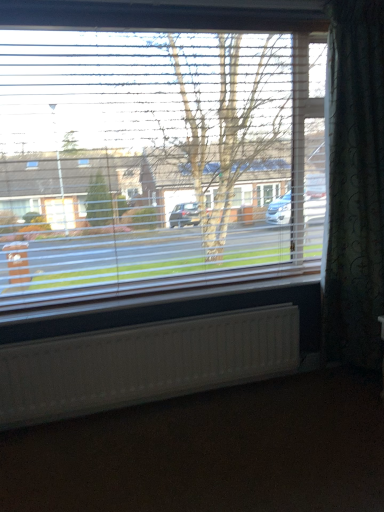
This screenshot has height=512, width=384. What are the coordinates of `brown matte carpet at lower center` in the screenshot? It's located at (210, 452).

Is dark green textured curtain at right oriented away from white textured radiator at lower center?

dark green textured curtain at right is not turned away from white textured radiator at lower center.

Which object is further away from the camera, dark green textured curtain at right or white textured radiator at lower center?

white textured radiator at lower center is more distant.

Would you say dark green textured curtain at right is a long distance from white textured radiator at lower center?

They are positioned close to each other.

Is white textured radiator at lower center directly adjacent to transparent plastic blinds at upper center?

white textured radiator at lower center and transparent plastic blinds at upper center are clearly separated.

Is white textured radiator at lower center oriented away from transparent plastic blinds at upper center?

No.

Where is `radiator behind the transparent plastic blinds at upper center`? radiator behind the transparent plastic blinds at upper center is located at coordinates (144, 362).

Considering the relative sizes of white textured radiator at lower center and transparent plastic blinds at upper center in the image provided, is white textured radiator at lower center wider than transparent plastic blinds at upper center?

No.

From a real-world perspective, is transparent plastic blinds at upper center below white textured radiator at lower center?

No.

From the image's perspective, is transparent plastic blinds at upper center on white textured radiator at lower center?

Yes, from the image's perspective, transparent plastic blinds at upper center is on top of white textured radiator at lower center.

Is transparent plastic blinds at upper center positioned far away from white textured radiator at lower center?

No, transparent plastic blinds at upper center is not far away from white textured radiator at lower center.

What's the angular difference between transparent plastic blinds at upper center and white textured radiator at lower center's facing directions?

0.0192 degrees.

In the scene shown: From a real-world perspective, which object rests below the other?

brown matte carpet at lower center, from a real-world perspective.

Would you say white textured radiator at lower center contains brown matte carpet at lower center?

No, brown matte carpet at lower center is not surrounded by white textured radiator at lower center.

Which object is further away from the camera, white textured radiator at lower center or brown matte carpet at lower center?

white textured radiator at lower center is further from the camera.

From the image's perspective, which is below, white textured radiator at lower center or brown matte carpet at lower center?

From the image's view, brown matte carpet at lower center is below.

Visually, is transparent plastic blinds at upper center positioned to the left or to the right of dark green textured curtain at right?

Based on their positions, transparent plastic blinds at upper center is located to the left of dark green textured curtain at right.

Is point (107, 258) closer to camera compared to point (327, 276)?

Yes, point (107, 258) is in front of point (327, 276).

Considering the sizes of transparent plastic blinds at upper center and dark green textured curtain at right in the image, is transparent plastic blinds at upper center taller or shorter than dark green textured curtain at right?

Considering their sizes, transparent plastic blinds at upper center has less height than dark green textured curtain at right.

Is brown matte carpet at lower center inside transparent plastic blinds at upper center?

No, brown matte carpet at lower center is located outside of transparent plastic blinds at upper center.

From the image's perspective, is transparent plastic blinds at upper center over brown matte carpet at lower center?

Yes.

Is transparent plastic blinds at upper center next to brown matte carpet at lower center and touching it?

No, transparent plastic blinds at upper center is not making contact with brown matte carpet at lower center.

From a real-world perspective, is transparent plastic blinds at upper center on top of brown matte carpet at lower center?

Yes, from a real-world perspective, transparent plastic blinds at upper center is on top of brown matte carpet at lower center.

Is brown matte carpet at lower center touching dark green textured curtain at right?

No, brown matte carpet at lower center is not in contact with dark green textured curtain at right.

From a real-world perspective, which object stands above the other?

dark green textured curtain at right, from a real-world perspective.

From the image's perspective, is brown matte carpet at lower center under dark green textured curtain at right?

Correct, brown matte carpet at lower center appears lower than dark green textured curtain at right in the image.

Considering the positions of objects brown matte carpet at lower center and dark green textured curtain at right in the image provided, who is behind, brown matte carpet at lower center or dark green textured curtain at right?

Positioned behind is dark green textured curtain at right.

Identify the location of curtain on the right of white textured radiator at lower center. The width and height of the screenshot is (384, 512). (355, 185).

This screenshot has height=512, width=384. Identify the location of window located above the white textured radiator at lower center (from a real-world perspective). (157, 145).

Looking at the image, which one is located closer to brown matte carpet at lower center, dark green textured curtain at right or white textured radiator at lower center?

The object closer to brown matte carpet at lower center is white textured radiator at lower center.

Which object lies further to the anchor point dark green textured curtain at right, brown matte carpet at lower center or white textured radiator at lower center?

brown matte carpet at lower center is positioned further to the anchor dark green textured curtain at right.

Considering their positions, is dark green textured curtain at right positioned further to transparent plastic blinds at upper center than white textured radiator at lower center?

dark green textured curtain at right lies further to transparent plastic blinds at upper center than the other object.

Considering their positions, is transparent plastic blinds at upper center positioned closer to white textured radiator at lower center than brown matte carpet at lower center?

brown matte carpet at lower center.

Looking at the image, which one is located closer to dark green textured curtain at right, transparent plastic blinds at upper center or brown matte carpet at lower center?

Among the two, transparent plastic blinds at upper center is located nearer to dark green textured curtain at right.

Considering their positions, is white textured radiator at lower center positioned closer to dark green textured curtain at right than transparent plastic blinds at upper center?

transparent plastic blinds at upper center is closer to dark green textured curtain at right.

Considering their positions, is dark green textured curtain at right positioned closer to transparent plastic blinds at upper center than brown matte carpet at lower center?

dark green textured curtain at right is positioned closer to the anchor transparent plastic blinds at upper center.

Based on their spatial positions, is dark green textured curtain at right or brown matte carpet at lower center closer to white textured radiator at lower center?

Among the two, brown matte carpet at lower center is located nearer to white textured radiator at lower center.

What are the coordinates of `window situated between white textured radiator at lower center and dark green textured curtain at right from left to right` in the screenshot? It's located at (157, 145).

The height and width of the screenshot is (512, 384). In order to click on radiator between transparent plastic blinds at upper center and brown matte carpet at lower center in the vertical direction in this screenshot , I will do pos(144,362).

At what (x,y) coordinates should I click in order to perform the action: click on curtain between transparent plastic blinds at upper center and brown matte carpet at lower center in the up-down direction. Please return your answer as a coordinate pair (x, y). This screenshot has height=512, width=384. Looking at the image, I should click on (355, 185).

Where is `radiator between dark green textured curtain at right and brown matte carpet at lower center in the vertical direction`? This screenshot has height=512, width=384. radiator between dark green textured curtain at right and brown matte carpet at lower center in the vertical direction is located at coordinates (144, 362).